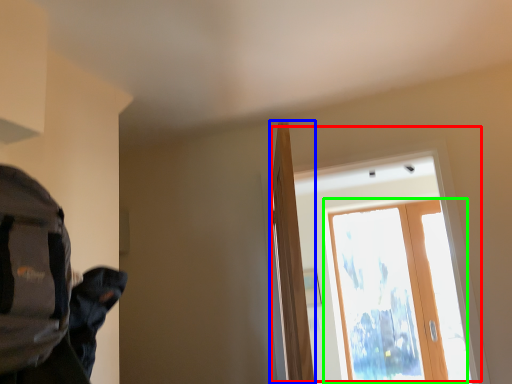
Question: Which is farther away from window (highlighted by a red box)? door (highlighted by a blue box) or screen door (highlighted by a green box)?

Choices:
 (A) door
 (B) screen door

Answer: (A)